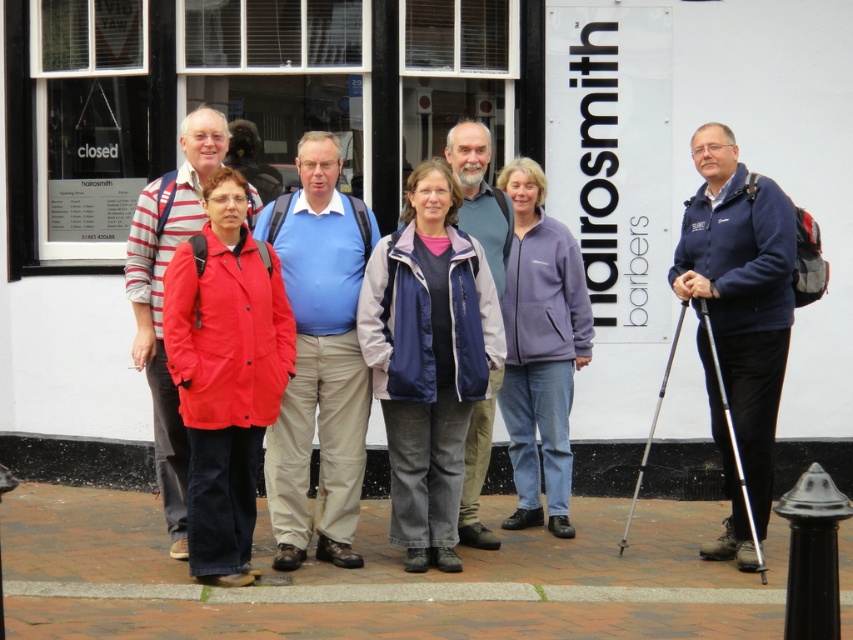
Based on the photo, you are a photographer arranging two people wearing a navy blue fabric jacket at center and a purple fleece jacket at center for a photo. The minimum distance required between them is 36 inches to avoid blurring. Can they stand closer together than they are now?

The navy blue fabric jacket at center and purple fleece jacket at center are currently 35.54 inches apart, which is less than the required 36 inches. To avoid blurring, they should move slightly apart to meet the minimum distance requirement.

You are standing in front of the Hairsmith Barbers building and want to step onto the brick pavement at lower center. Based on the coordinates provided, where should you move relative to your current position?

The brick pavement at lower center is located at coordinates point (x=386, y=579), so you should move towards that point to step onto it.

You are standing on the brick pavement at lower center and want to move to the navy blue fabric jacket at center. Which direction should you walk to get there?

The brick pavement at lower center is to the left of the navy blue fabric jacket at center, so you should walk to the right to reach the navy blue fabric jacket at center.